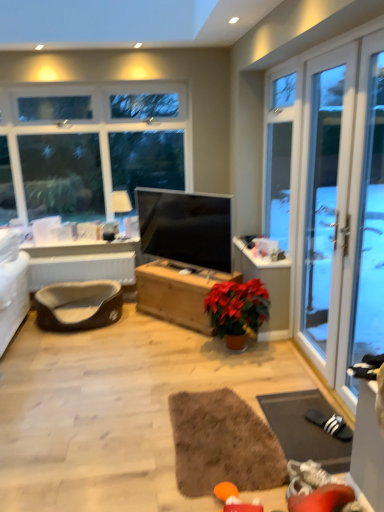
You are a GUI agent. You are given a task and a screenshot of the screen. Output one action in this format:
    pyautogui.click(x=<x>, y=<y>)
    Task: Click on the vacant space in front of brown fabric pet bed at lower left
    The image size is (384, 512).
    Given the screenshot: What is the action you would take?
    pyautogui.click(x=84, y=346)